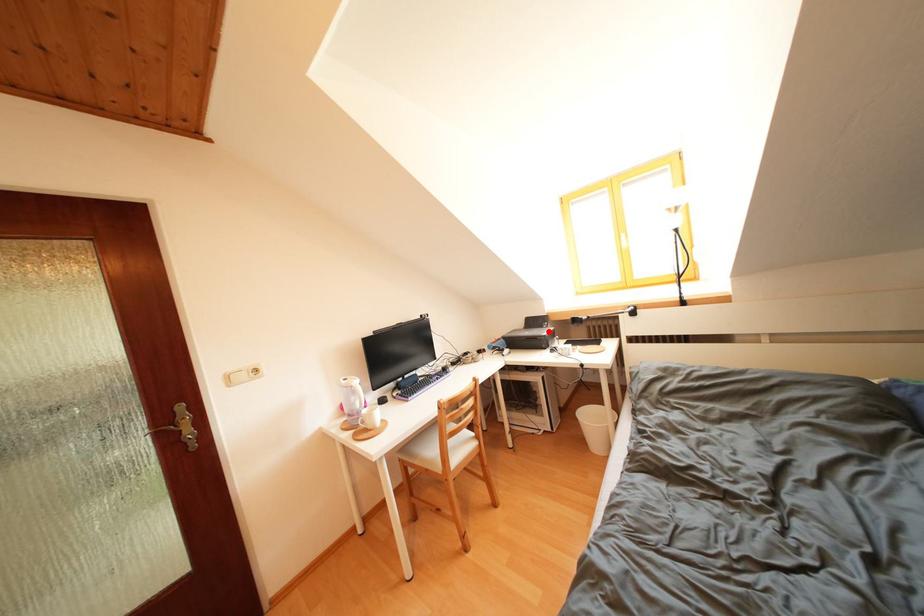
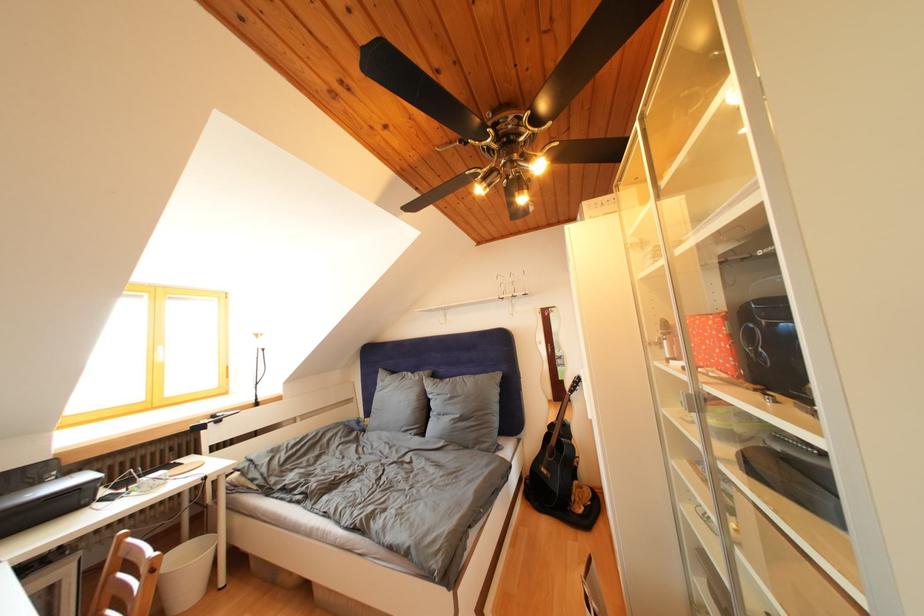
Question: A red point is marked in image1. In image2, is the corresponding 3D point closer to the camera or farther? Reply with the corresponding letter.

Choices:
 (A) The corresponding 3D point is closer.
 (B) The corresponding 3D point is farther.

Answer: (A)